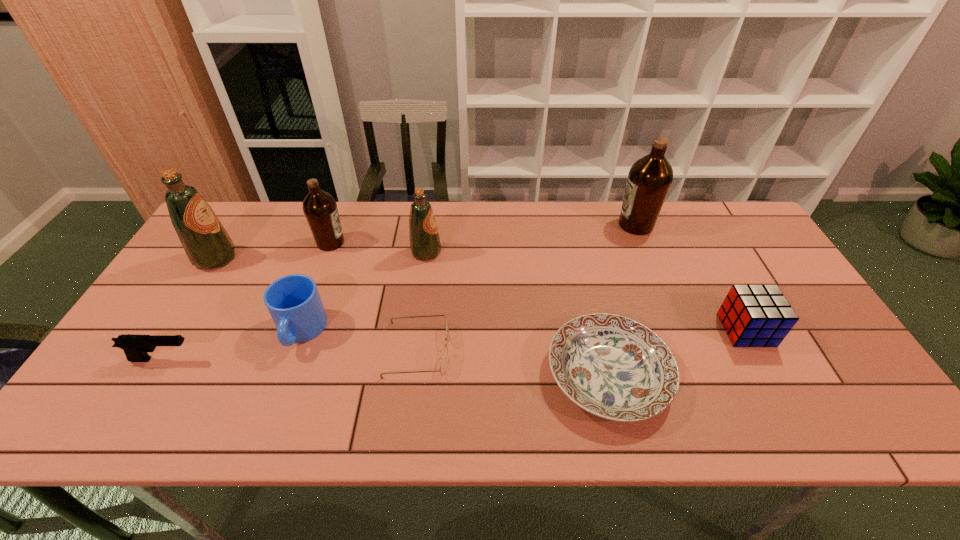
Locate an element on the screen. blank region between the right green olive oil and the plate is located at coordinates (517, 313).

Identify the location of empty space between the cube and the left brown olive oil. The width and height of the screenshot is (960, 540). (539, 286).

The width and height of the screenshot is (960, 540). Find the location of `free spot between the black pistol and the left brown olive oil`. free spot between the black pistol and the left brown olive oil is located at coordinates (247, 301).

Find the location of `free space between the plate and the beige spectacles`. free space between the plate and the beige spectacles is located at coordinates (514, 362).

Identify the location of free space between the right green olive oil and the mug. The image size is (960, 540). (364, 292).

Identify the location of empty location between the bigger brown olive oil and the mug. The width and height of the screenshot is (960, 540). (468, 278).

Find the location of a particular element. object that stands as the sixth closest to the right brown olive oil is located at coordinates (293, 301).

Select which object appears as the eighth closest to the smaller brown olive oil. Please provide its 2D coordinates. Your answer should be formatted as a tuple, i.e. [(x, y)], where the tuple contains the x and y coordinates of a point satisfying the conditions above.

[(752, 315)]

Identify the location of olive oil that is the nearest to the right green olive oil. (320, 209).

Where is `olive oil that stands as the second closest to the right brown olive oil`? The height and width of the screenshot is (540, 960). olive oil that stands as the second closest to the right brown olive oil is located at coordinates (320, 209).